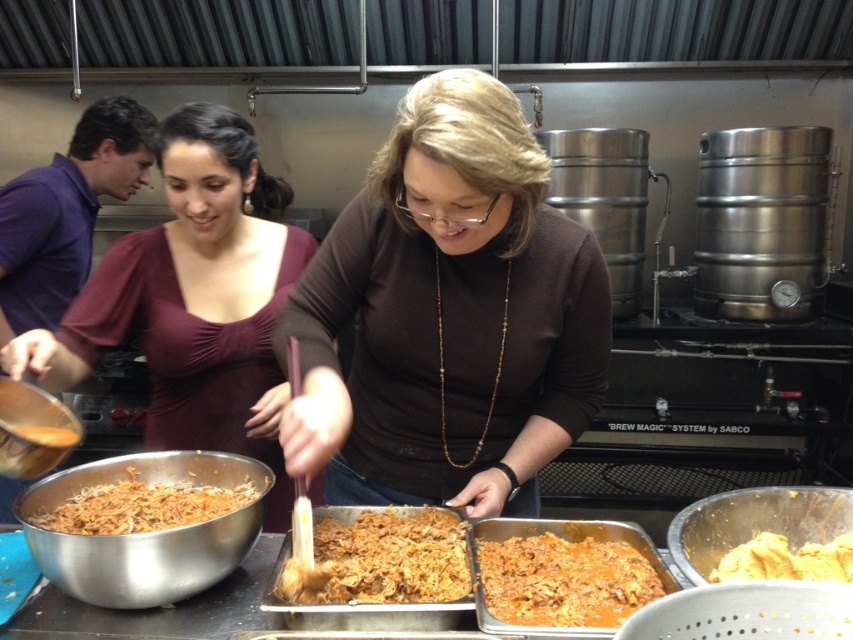
Question: Which object is closer to the camera taking this photo?

Choices:
 (A) brown shredded food at lower left
 (B) brown matte shirt at center

Answer: (B)

Question: Does brown shredded food at lower left have a greater width compared to yellow crumbly food at center?

Choices:
 (A) no
 (B) yes

Answer: (B)

Question: Can you confirm if brown matte shirt at center is bigger than brown crumbly food at center?

Choices:
 (A) yes
 (B) no

Answer: (A)

Question: Considering the real-world distances, which object is farthest from the matte burgundy blouse at center?

Choices:
 (A) shiny silver bowl at lower left
 (B) brown crumbly food at center

Answer: (B)

Question: Is matte burgundy blouse at center further to camera compared to brown matte food at center?

Choices:
 (A) no
 (B) yes

Answer: (B)

Question: Which of the following is the closest to the observer?

Choices:
 (A) shiny silver bowl at lower left
 (B) brown matte shirt at center
 (C) brown shredded food at lower left

Answer: (B)